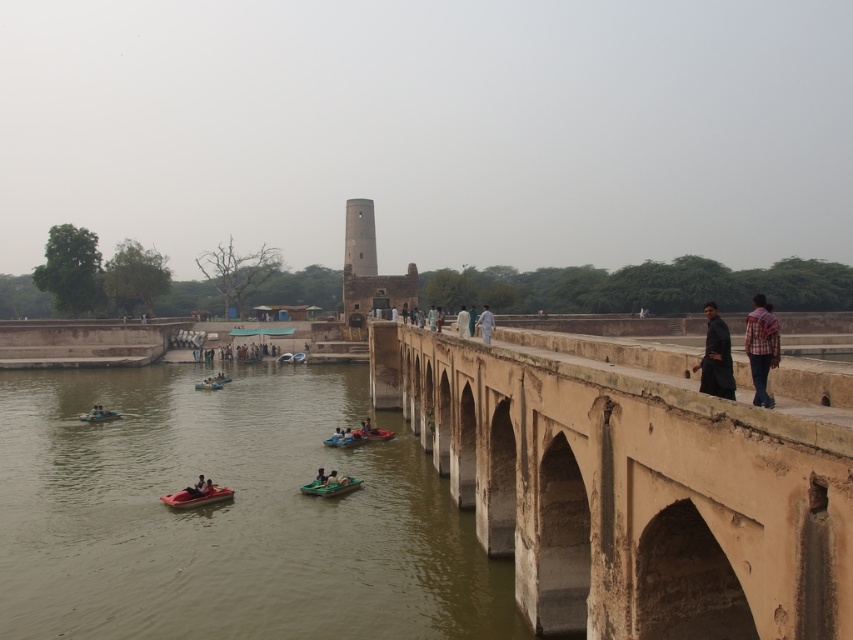
You are a tourist standing on the beige stone bridge at center and want to reach the light beige stone person at center. Given that the average walking speed is 3 feet per second, how many seconds will it take you to reach them?

The distance between the beige stone bridge at center and the light beige stone person at center is 48.26 feet. At a walking speed of 3 feet per second, dividing the distance by the speed gives approximately 16.09 seconds. Therefore, it would take roughly 16 seconds to reach them.

You are standing on the historic stone bridge and want to take a photo of the brown stone river at lower left and the brown stone tower at center. Which object should you point your camera downward to capture?

You should point your camera downward to capture the brown stone river at lower left because it is located below the brown stone tower at center.